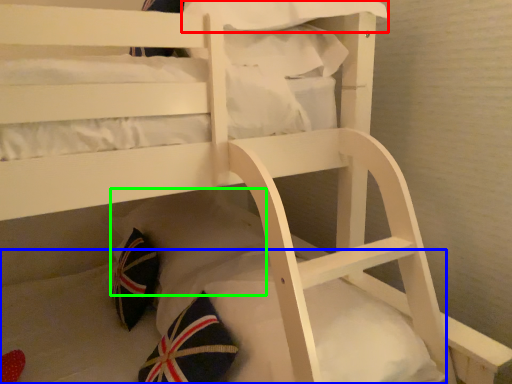
Question: Considering the real-world distances, which object is farthest from pillow (highlighted by a red box)? mattress (highlighted by a blue box) or pillow (highlighted by a green box)?

Choices:
 (A) mattress
 (B) pillow

Answer: (A)